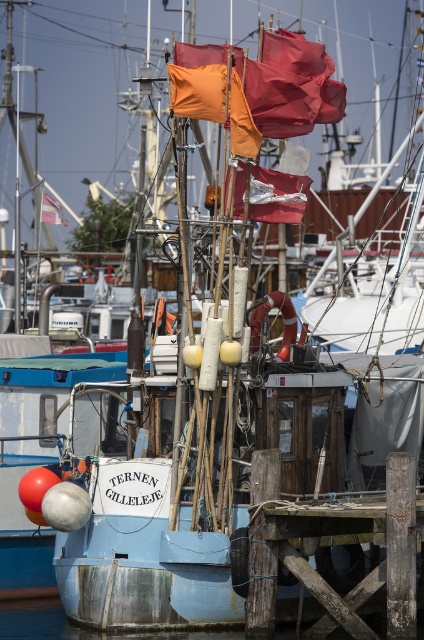
Question: Is weathered wood dock at lower right closer to the viewer compared to orange fabric flag at upper center?

Choices:
 (A) yes
 (B) no

Answer: (A)

Question: In this image, where is weathered wood dock at lower right located relative to orange fabric flags at upper center?

Choices:
 (A) above
 (B) below

Answer: (B)

Question: Does weathered wood dock at lower right have a lesser width compared to orange fabric flags at upper center?

Choices:
 (A) yes
 (B) no

Answer: (A)

Question: Based on their relative distances, which object is farther from the orange fabric flag at upper center?

Choices:
 (A) shiny silver flag at center
 (B) orange fabric flags at upper center

Answer: (A)

Question: Which point appears farthest from the camera in this image?

Choices:
 (A) (376, 534)
 (B) (279, 209)

Answer: (B)

Question: Which is farther from the weathered wood dock at lower right?

Choices:
 (A) orange fabric flags at upper center
 (B) shiny silver flag at center

Answer: (A)